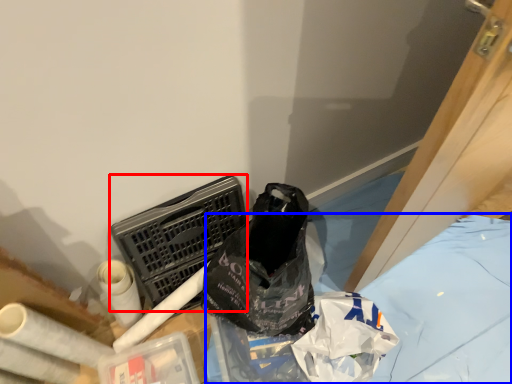
Question: Which object is further to the camera taking this photo, laundry basket (highlighted by a red box) or sheet (highlighted by a blue box)?

Choices:
 (A) laundry basket
 (B) sheet

Answer: (B)